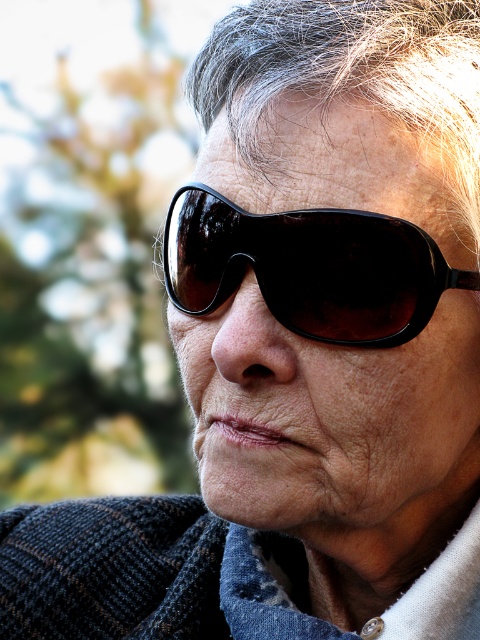
Based on the photo, does faded denim jacket at lower right have a lesser width compared to black plastic sunglasses at center?

No.

Based on the photo, who is positioned more to the right, faded denim jacket at lower right or black plastic sunglasses at center?

black plastic sunglasses at center

Between point (151, 520) and point (400, 337), which one is positioned in front?

Point (400, 337) is more forward.

Find the location of `faded denim jacket at lower right`. faded denim jacket at lower right is located at coordinates (144, 573).